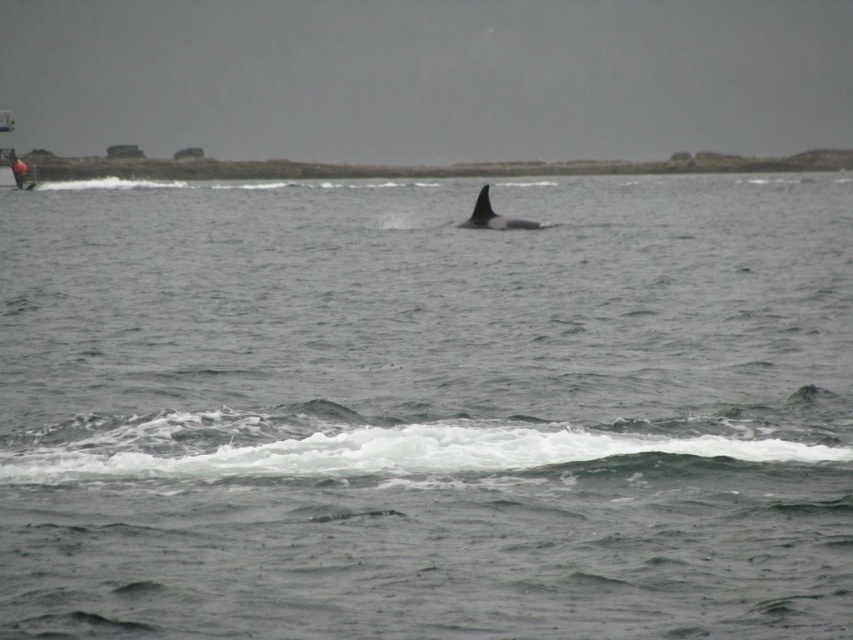
Does gray matte water at center appear over black smooth whale at center?

Correct, gray matte water at center is located above black smooth whale at center.

Does point (498, 301) come in front of point (508, 216)?

Yes, it is in front of point (508, 216).

Locate an element on the screen. The width and height of the screenshot is (853, 640). gray matte water at center is located at coordinates (426, 408).